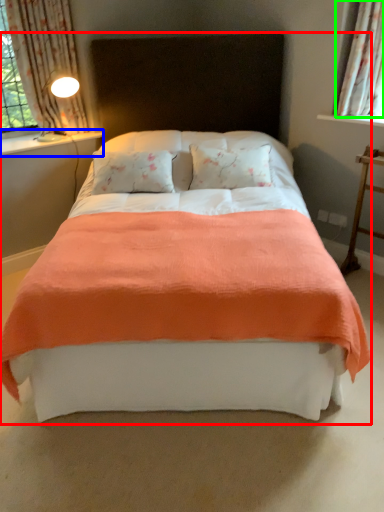
Question: Estimate the real-world distances between objects in this image. Which object is farther from bed (highlighted by a red box), window sill (highlighted by a blue box) or curtain (highlighted by a green box)?

Choices:
 (A) window sill
 (B) curtain

Answer: (A)